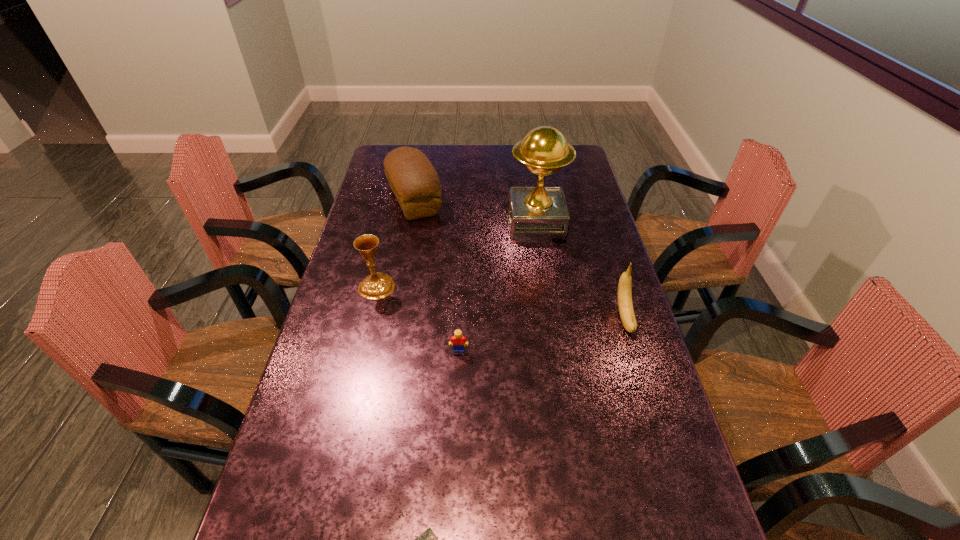
Find the location of a particular element. Image resolution: width=960 pixels, height=540 pixels. blank area at the right edge is located at coordinates (553, 178).

The image size is (960, 540). Find the location of `empty location between the chalice and the award`. empty location between the chalice and the award is located at coordinates (457, 256).

Image resolution: width=960 pixels, height=540 pixels. I want to click on free space that is in between the award and the bread, so click(x=475, y=213).

At what (x,y) coordinates should I click in order to perform the action: click on free point between the bread and the tallest object. Please return your answer as a coordinate pair (x, y). The height and width of the screenshot is (540, 960). Looking at the image, I should click on (475, 213).

You are a GUI agent. You are given a task and a screenshot of the screen. Output one action in this format:
    pyautogui.click(x=<x>, y=<y>)
    Task: Click on the free space between the bread and the tallest object
    The width and height of the screenshot is (960, 540).
    Given the screenshot: What is the action you would take?
    pyautogui.click(x=475, y=213)

Where is `vacant point located between the chalice and the fifth tallest object`? vacant point located between the chalice and the fifth tallest object is located at coordinates 418,318.

Find the location of a particular element. This screenshot has height=540, width=960. vacant space that's between the chalice and the tallest object is located at coordinates (457, 256).

You are a GUI agent. You are given a task and a screenshot of the screen. Output one action in this format:
    pyautogui.click(x=<x>, y=<y>)
    Task: Click on the third closest object to the banana
    
    Given the screenshot: What is the action you would take?
    pyautogui.click(x=412, y=178)

At what (x,y) coordinates should I click in order to perform the action: click on object that ranks as the closest to the bread. Please return your answer as a coordinate pair (x, y). Looking at the image, I should click on (536, 214).